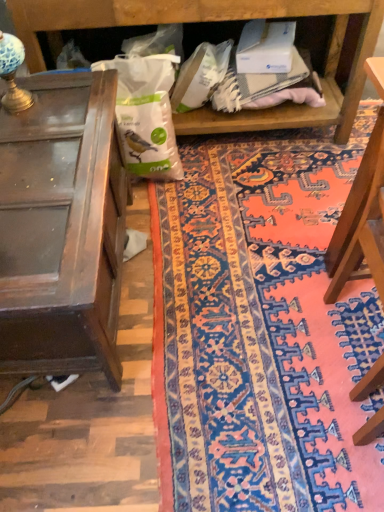
Find the location of `vacant area that lies between wooden chair at right and white matte paper bag at center`. vacant area that lies between wooden chair at right and white matte paper bag at center is located at coordinates (237, 247).